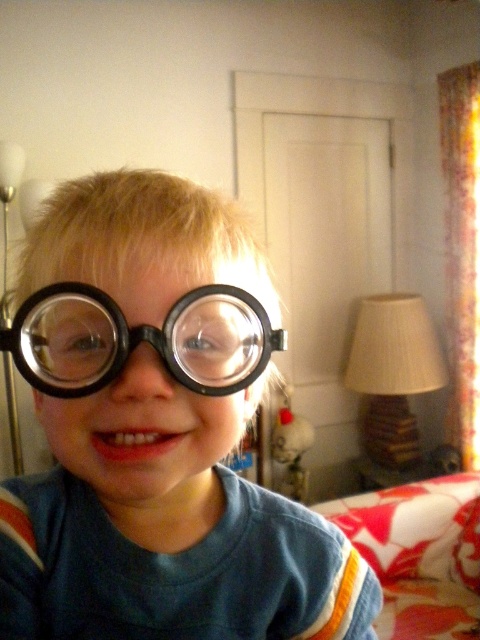
Is matte black glasses at center wider than black matte goggles at center?

Yes.

Which is behind, point (175, 348) or point (66, 342)?

Positioned behind is point (66, 342).

Locate an element on the screen. matte black glasses at center is located at coordinates (156, 435).